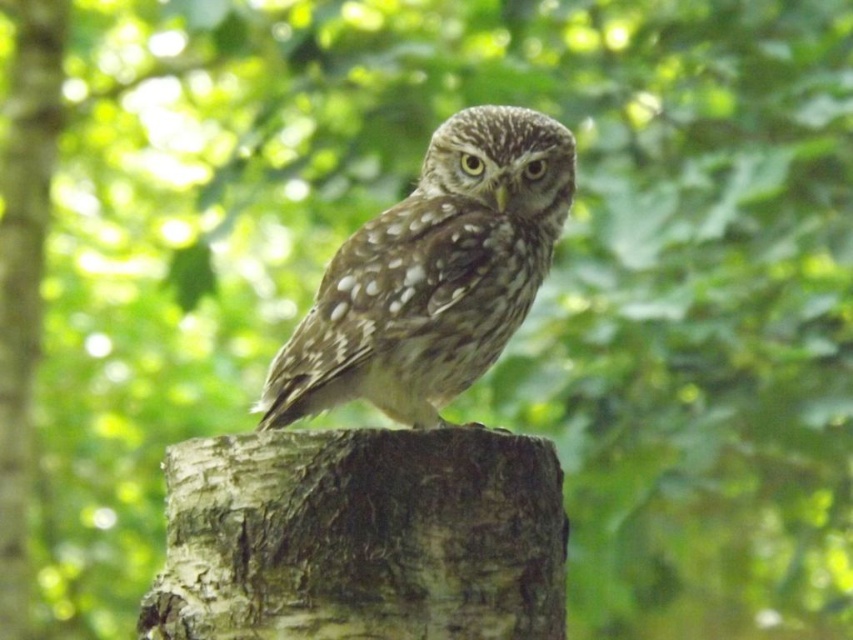
Is point (373, 369) positioned before point (15, 29)?

Yes, it is.

Is speckled feathered owl at center above smooth bark tree trunk at center?

Indeed, speckled feathered owl at center is positioned over smooth bark tree trunk at center.

Is point (509, 170) in front of point (3, 163)?

Yes, point (509, 170) is closer to viewer.

Identify the location of speckled feathered owl at center. (432, 275).

Where is `rough bark stump at center`? Image resolution: width=853 pixels, height=640 pixels. rough bark stump at center is located at coordinates (361, 538).

Is rough bark stump at center wider than speckled feathered owl at center?

No.

Is rough bark stump at center below speckled feathered owl at center?

Yes, rough bark stump at center is below speckled feathered owl at center.

Which is behind, point (279, 506) or point (421, 378)?

Point (421, 378)

Locate an element on the screen. This screenshot has width=853, height=640. rough bark stump at center is located at coordinates (361, 538).